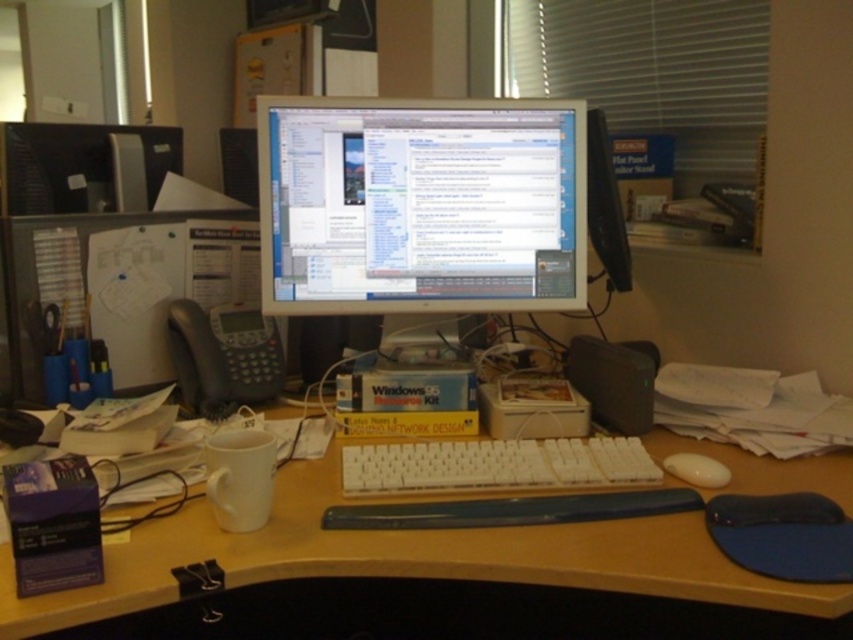
You are sitting at the desk and want to reach the white plastic keyboard at center without moving your chair. Can you comfortably reach it if your arms can extend 1 meter?

The white plastic keyboard at center is 1.07 meters away from viewer, so it is slightly out of reach since your arms can only extend 1 meter.

In the scene shown: You are organizing the desk and want to place the white plastic keyboard at center on the wooden desk at center. Will the keyboard fit entirely on the desk?

The wooden desk at center is wider than the white plastic keyboard at center, so the keyboard will fit entirely on the desk.